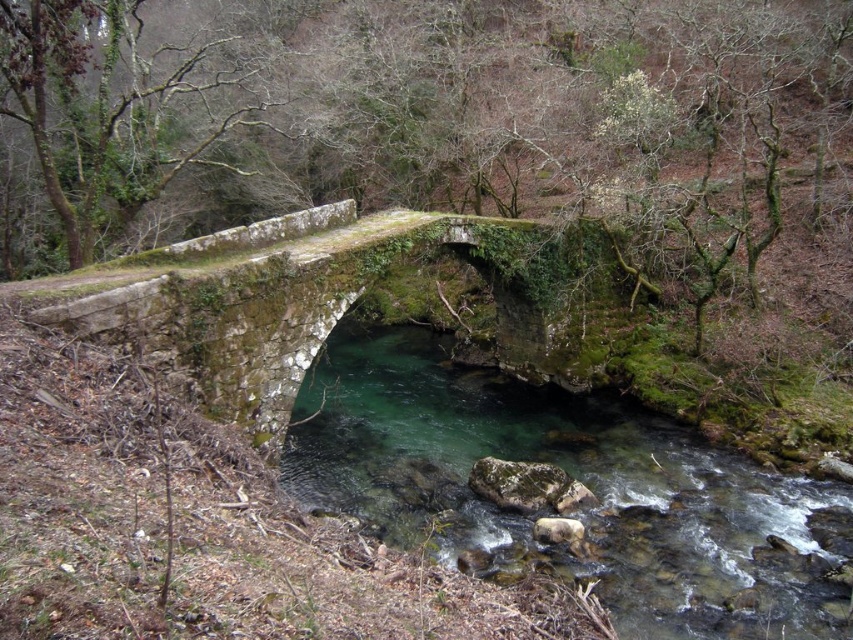
Question: Can you confirm if green stone river at center is positioned to the right of green mossy stone bridge at center?

Choices:
 (A) yes
 (B) no

Answer: (A)

Question: Which object is farther from the camera taking this photo?

Choices:
 (A) green stone river at center
 (B) green mossy stone bridge at center

Answer: (A)

Question: Is green stone river at center wider than green mossy stone bridge at center?

Choices:
 (A) no
 (B) yes

Answer: (B)

Question: Which object appears farthest from the camera in this image?

Choices:
 (A) green mossy stone bridge at center
 (B) green stone river at center

Answer: (B)

Question: Which point is farther to the camera?

Choices:
 (A) (554, 561)
 (B) (222, 336)

Answer: (B)

Question: Is green stone river at center above green mossy stone bridge at center?

Choices:
 (A) yes
 (B) no

Answer: (B)